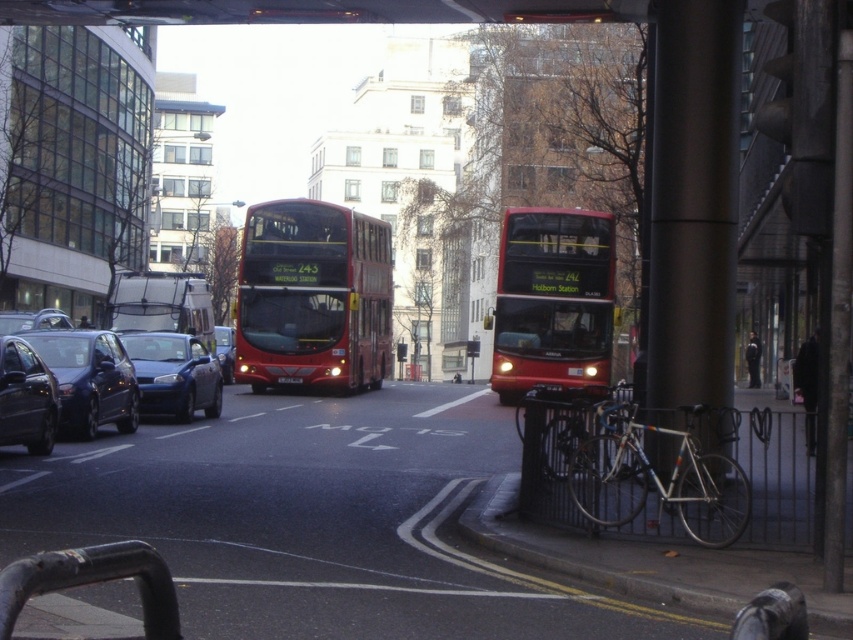
Is shiny red bus at center taller than black plastic license plate at center?

Yes.

Which is above, shiny red bus at center or black plastic license plate at center?

shiny red bus at center is higher up.

Identify the location of shiny red bus at center. (552, 300).

Does shiny red bus at center have a lesser height compared to metallic silver bus at center?

No.

Is shiny red bus at center above metallic silver bus at center?

Actually, shiny red bus at center is below metallic silver bus at center.

Between point (583, 296) and point (125, 330), which one is positioned behind?

The point (125, 330) is behind.

Identify the location of shiny red bus at center. The width and height of the screenshot is (853, 640). (552, 300).

Is metallic blue sedan at center-left taller than shiny black sedan at left?

Correct, metallic blue sedan at center-left is much taller as shiny black sedan at left.

Who is taller, metallic blue sedan at center-left or shiny black sedan at left?

metallic blue sedan at center-left

In order to click on metallic blue sedan at center-left in this screenshot , I will do `click(173, 374)`.